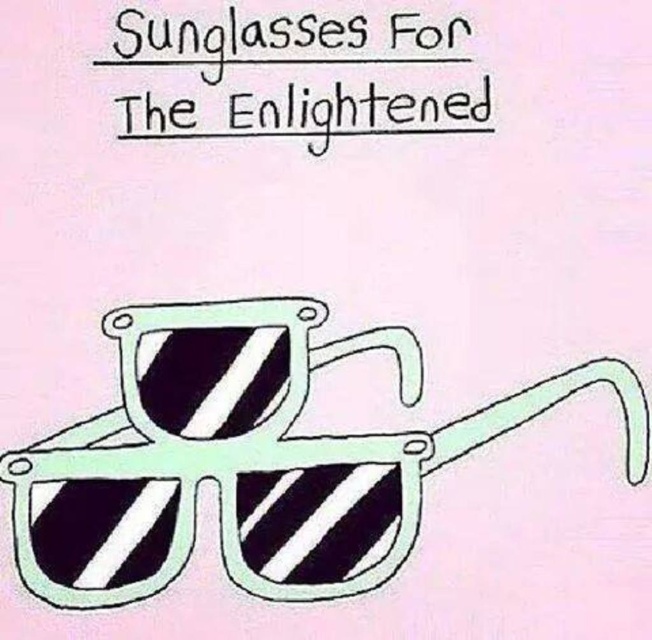
Is white striped plastic sunglasses at center positioned in front of black paper at upper center?

Yes, it is in front of black paper at upper center.

Can you confirm if white striped plastic sunglasses at center is taller than black paper at upper center?

Indeed, white striped plastic sunglasses at center has a greater height compared to black paper at upper center.

Locate an element on the screen. The image size is (652, 640). white striped plastic sunglasses at center is located at coordinates (248, 460).